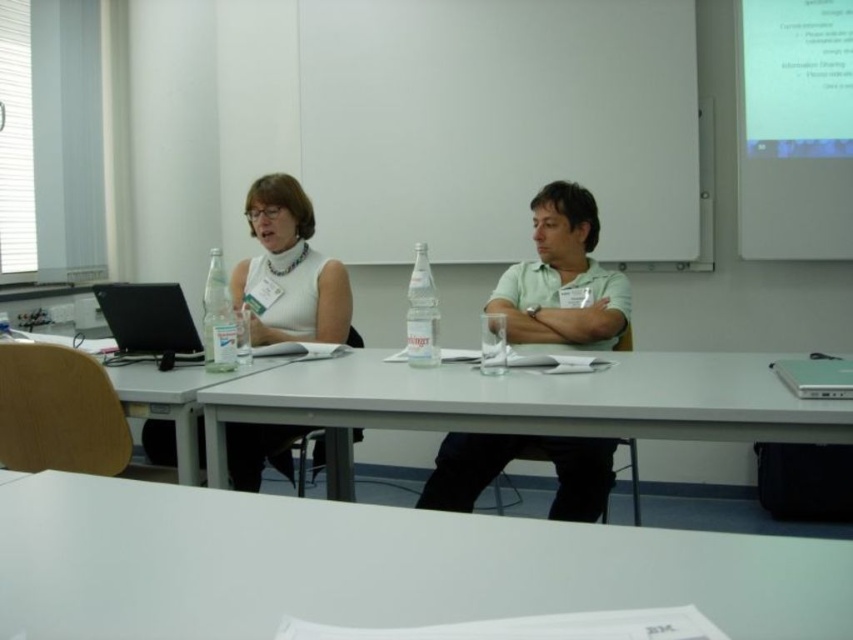
Is clear glass water bottle at center thinner than clear plastic bottle at center?

No, clear glass water bottle at center is not thinner than clear plastic bottle at center.

Identify the location of clear glass water bottle at center. This screenshot has height=640, width=853. (218, 317).

Where is `clear glass water bottle at center`? clear glass water bottle at center is located at coordinates (218, 317).

The image size is (853, 640). Identify the location of clear glass water bottle at center. (218, 317).

Does green matte shirt at center have a greater height compared to silver metallic laptop at right?

Correct, green matte shirt at center is much taller as silver metallic laptop at right.

You are a GUI agent. You are given a task and a screenshot of the screen. Output one action in this format:
    pyautogui.click(x=<x>, y=<y>)
    Task: Click on the green matte shirt at center
    The width and height of the screenshot is (853, 640).
    Given the screenshot: What is the action you would take?
    pyautogui.click(x=561, y=276)

This screenshot has height=640, width=853. What are the coordinates of `green matte shirt at center` in the screenshot? It's located at (561, 276).

Can you confirm if wooden table at left is bigger than black glossy laptop at left?

Yes, wooden table at left is bigger than black glossy laptop at left.

Between wooden table at left and black glossy laptop at left, which one appears on the right side from the viewer's perspective?

Positioned to the right is wooden table at left.

The image size is (853, 640). Describe the element at coordinates (70, 410) in the screenshot. I see `wooden table at left` at that location.

Image resolution: width=853 pixels, height=640 pixels. Find the location of `wooden table at left`. wooden table at left is located at coordinates (70, 410).